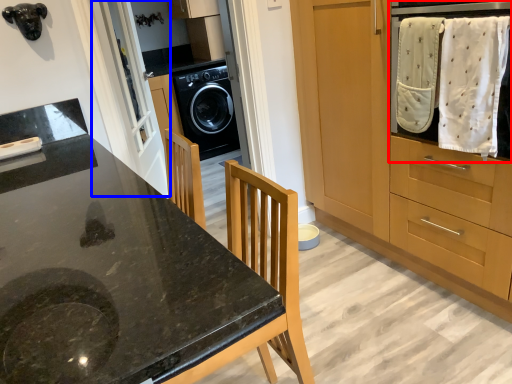
Question: Among these objects, which one is nearest to the camera, home appliance (highlighted by a red box) or screen door (highlighted by a blue box)?

Choices:
 (A) home appliance
 (B) screen door

Answer: (A)